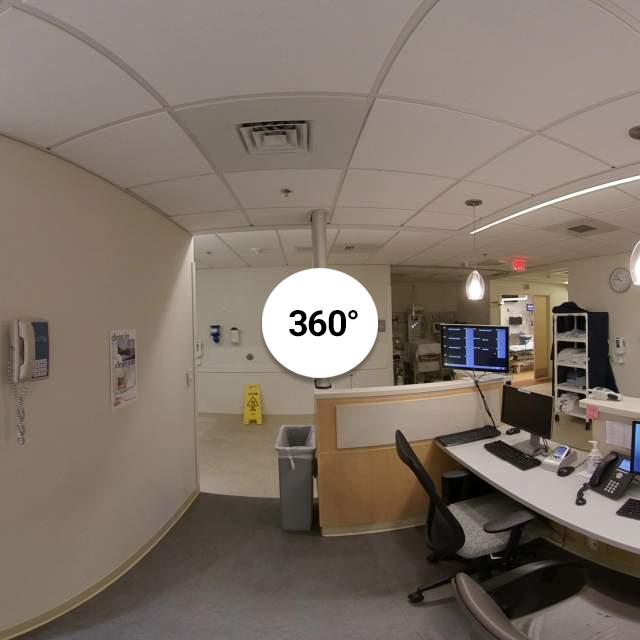
I want to click on calendar, so click(127, 372).